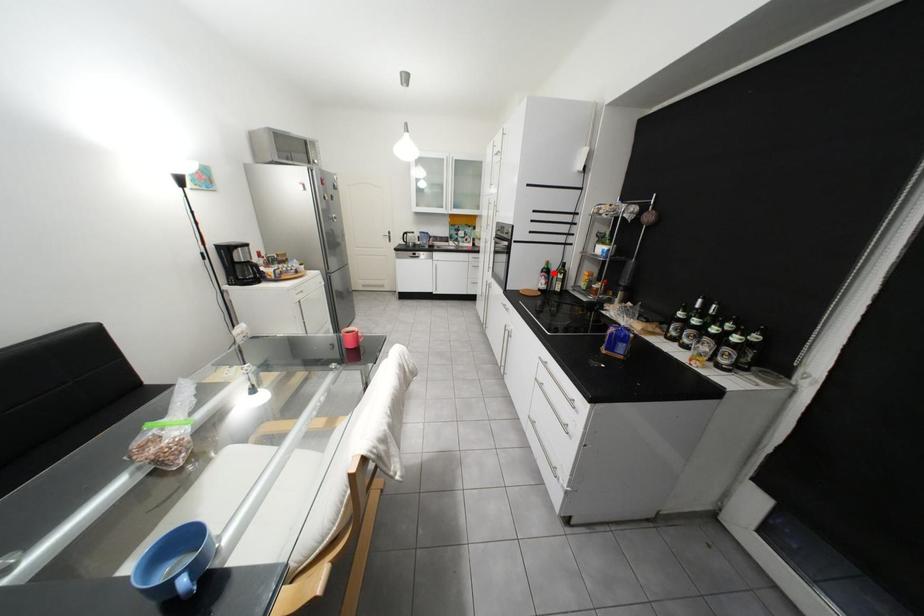
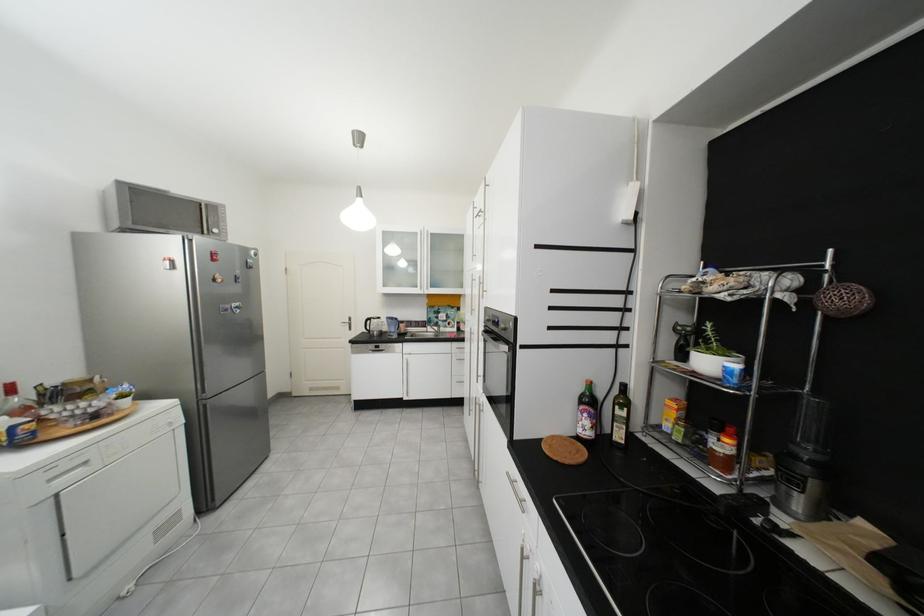
In the second image, find the point that corresponds to the highlighted location in the first image.

(592, 403)